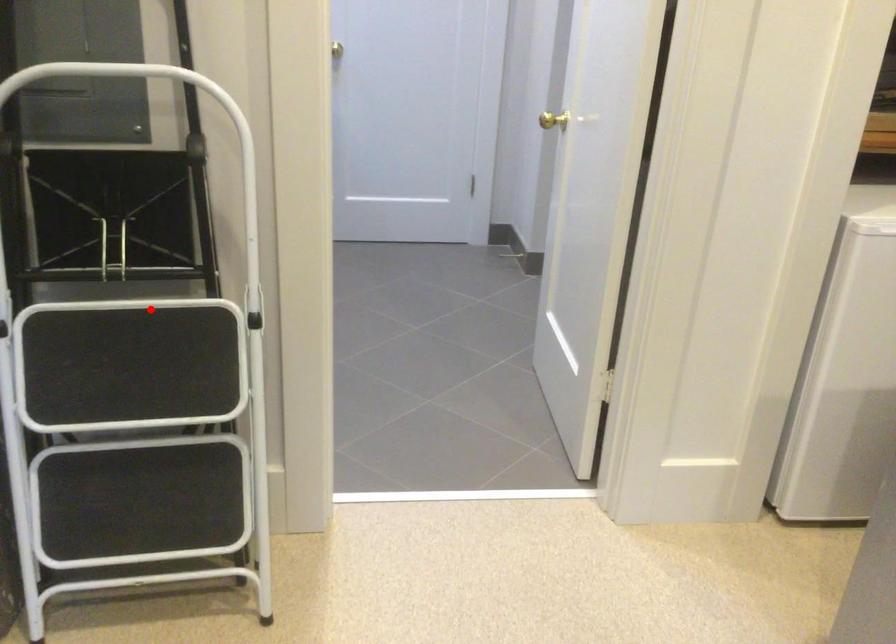
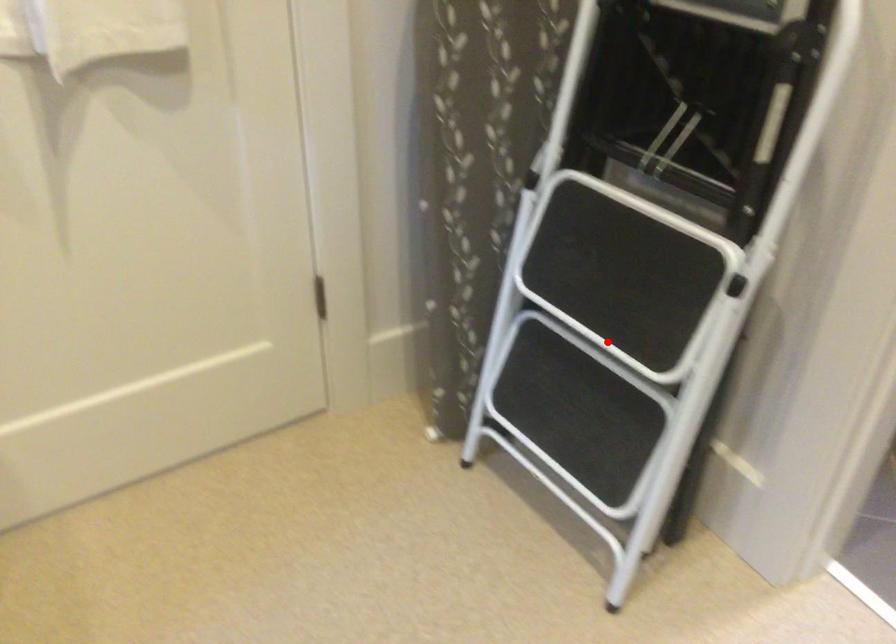
I am providing you with two images of the same scene from different viewpoints. A red point is marked on the first image and another point is marked on the second image. Do the highlighted points in image1 and image2 indicate the same real-world spot?

No